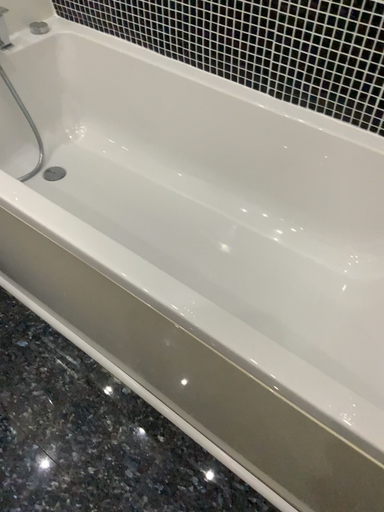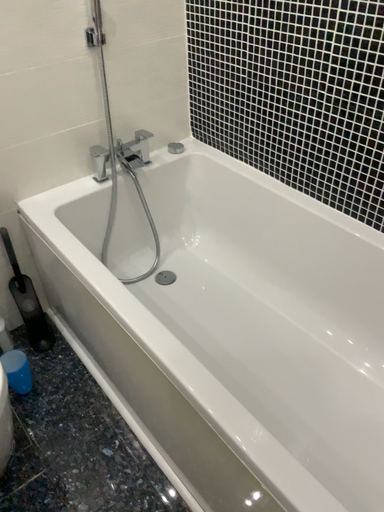
Question: How did the camera likely rotate when shooting the video?

Choices:
 (A) rotated right
 (B) rotated left

Answer: (B)